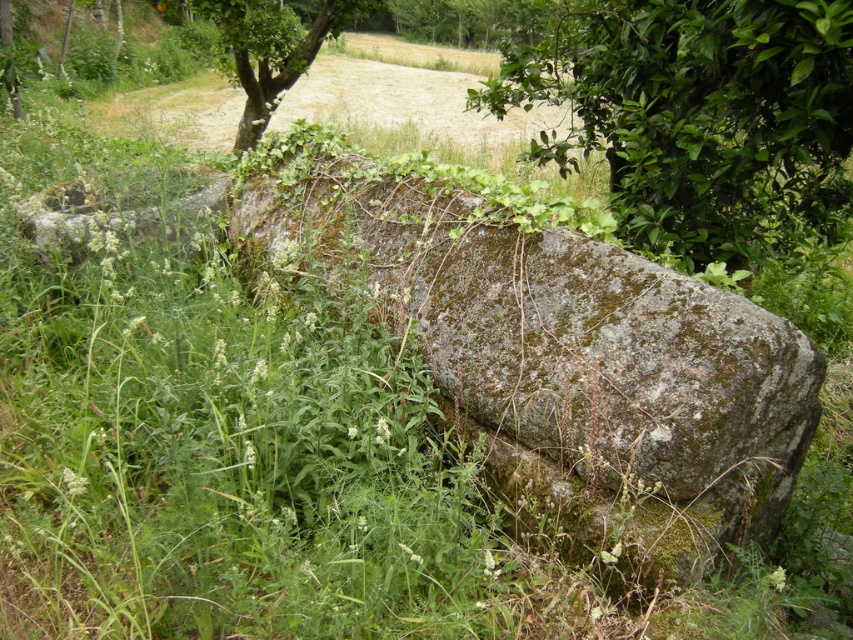
Who is positioned more to the right, green leafy tree at upper right or green leafy tree at upper left?

green leafy tree at upper right is more to the right.

Who is higher up, green leafy tree at upper right or green leafy tree at upper left?

Positioned higher is green leafy tree at upper left.

Image resolution: width=853 pixels, height=640 pixels. Find the location of `green leafy tree at upper right`. green leafy tree at upper right is located at coordinates (699, 116).

Which is above, mossy stone boulder at center or green leafy tree at upper left?

Positioned higher is green leafy tree at upper left.

In the scene shown: Who is more forward, (300, 220) or (305, 16)?

Point (300, 220) is more forward.

The height and width of the screenshot is (640, 853). Identify the location of mossy stone boulder at center. (560, 356).

Who is positioned more to the right, mossy stone boulder at center or green leafy tree at upper right?

green leafy tree at upper right

Who is shorter, mossy stone boulder at center or green leafy tree at upper right?

With less height is green leafy tree at upper right.

The height and width of the screenshot is (640, 853). I want to click on mossy stone boulder at center, so click(560, 356).